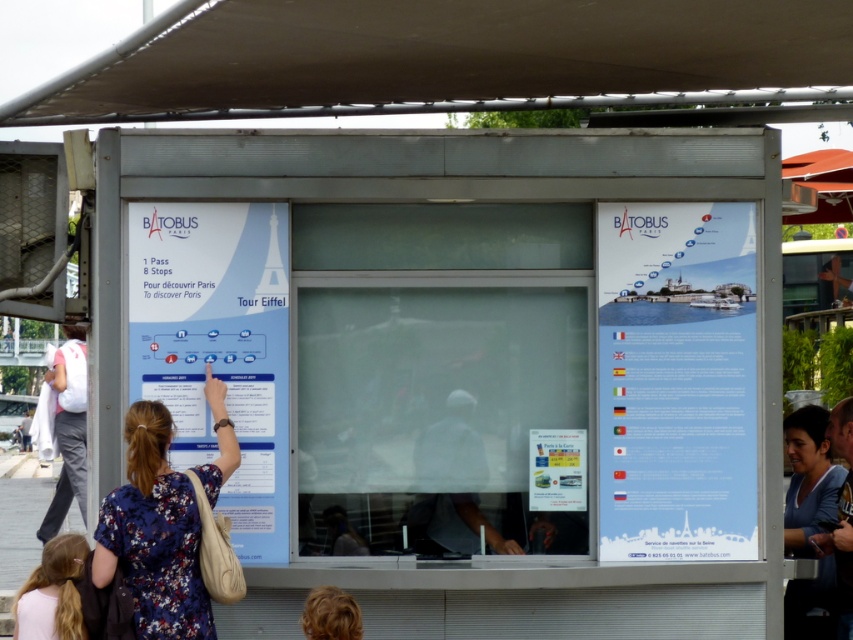
Is blonde hair at lower left below matte plastic ticket at center?

Correct, blonde hair at lower left is located below matte plastic ticket at center.

Who is more distant from viewer, (45, 573) or (569, 470)?

The point (45, 573) is behind.

Is point (74, 614) farther from camera compared to point (556, 493)?

No.

This screenshot has width=853, height=640. I want to click on blonde hair at lower left, so click(53, 593).

Is blonde hair at lower left thinner than blonde hair at lower center?

In fact, blonde hair at lower left might be wider than blonde hair at lower center.

Which is in front, point (44, 568) or point (329, 618)?

Point (329, 618)

Locate an element on the screen. blonde hair at lower left is located at coordinates (53, 593).

Which is more to the right, blue paper poster at right or matte plastic ticket at center?

From the viewer's perspective, blue paper poster at right appears more on the right side.

From the picture: Is blue paper poster at right further to the viewer compared to matte plastic ticket at center?

No, blue paper poster at right is in front of matte plastic ticket at center.

Is point (651, 410) positioned behind point (547, 451)?

No, it is not.

Where is `blue paper poster at right`? This screenshot has width=853, height=640. blue paper poster at right is located at coordinates (677, 380).